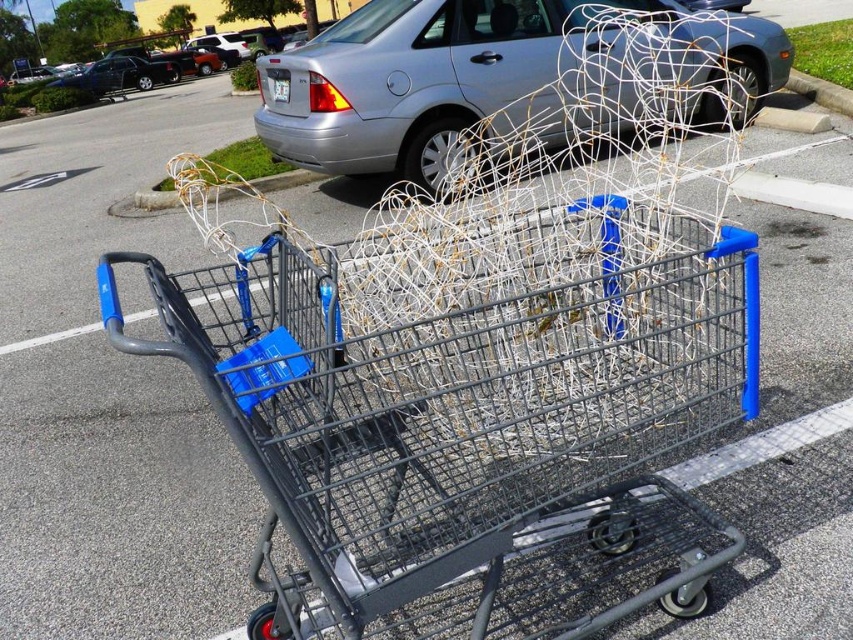
Question: Which point is farther to the camera?

Choices:
 (A) (520, 540)
 (B) (80, 52)

Answer: (B)

Question: Is metallic gray shopping cart at center bigger than silver metallic sedan at center?

Choices:
 (A) no
 (B) yes

Answer: (A)

Question: Which point appears closest to the camera in this image?

Choices:
 (A) (24, 58)
 (B) (595, 234)

Answer: (B)

Question: Where is metallic gray shopping cart at center located in relation to silver metallic sedan at center in the image?

Choices:
 (A) below
 (B) above

Answer: (A)

Question: Is metallic gray shopping cart at center wider than silver metallic sedan at center?

Choices:
 (A) yes
 (B) no

Answer: (B)

Question: Which object is closer to the camera taking this photo?

Choices:
 (A) silver metallic car at center
 (B) metallic gray shopping cart at center
 (C) silver metallic sedan at center

Answer: (B)